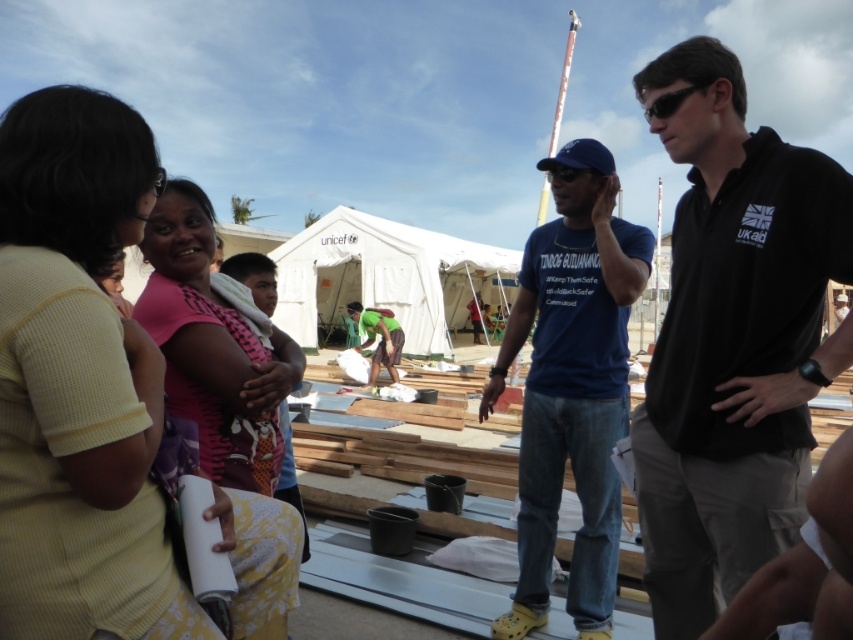
Is yellow textured shirt at upper left positioned behind green fabric shirt at center?

No, yellow textured shirt at upper left is in front of green fabric shirt at center.

Is point (74, 280) positioned after point (367, 312)?

No, it is not.

At what (x,y) coordinates should I click in order to perform the action: click on yellow textured shirt at upper left. Please return your answer as a coordinate pair (x, y). This screenshot has width=853, height=640. Looking at the image, I should click on (79, 381).

Describe the element at coordinates (732, 339) in the screenshot. The height and width of the screenshot is (640, 853). I see `black smooth polo shirt at center` at that location.

Does black smooth polo shirt at center appear on the left side of blue cotton shirt at center?

Incorrect, black smooth polo shirt at center is not on the left side of blue cotton shirt at center.

I want to click on black smooth polo shirt at center, so click(x=732, y=339).

Which is below, yellow textured shirt at upper left or blue cotton shirt at center?

blue cotton shirt at center

Is point (49, 452) closer to viewer compared to point (583, 502)?

Yes, it is in front of point (583, 502).

Does point (68, 100) come farther from viewer compared to point (572, 324)?

No, (68, 100) is closer to viewer.

Find the location of a particular element. The width and height of the screenshot is (853, 640). yellow textured shirt at upper left is located at coordinates (79, 381).